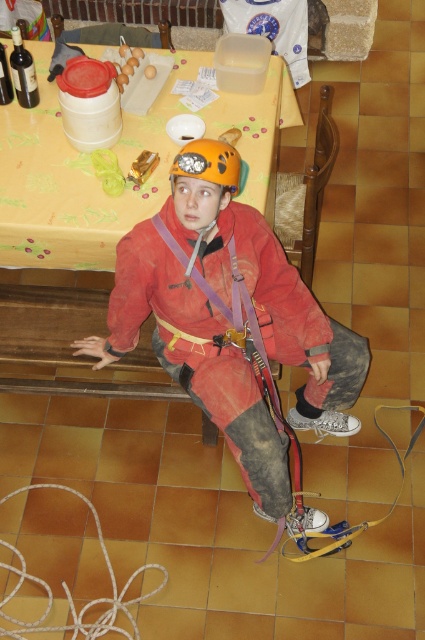
You are organizing a safety equipment display and need to place the red matte safety vest at center and orange matte helmet at center side by side on a shelf. Given that the shelf has a width of 40 cm, and the safety vest is wider than the helmet, can both items fit on the shelf without overlapping?

The red matte safety vest at center is wider than the orange matte helmet at center. However, since the exact widths are not provided, it is uncertain if both can fit on a 40 cm shelf. More information about their individual dimensions is needed to determine this.

You are organizing a safety equipment display in a small booth. The booth has limited space, and you need to arrange the red matte safety vest at center and orange matte helmet at center so that both are visible but not overcrowded. Considering their sizes, which item should you place closer to the edge of the booth to save space?

The orange matte helmet at center should be placed closer to the edge of the booth since it has a smaller size compared to the red matte safety vest at center, allowing both items to be displayed without overcrowding.

You are organizing a climbing gear setup. You need to place the matte orange helmet at center and the white rope at lower left in a storage box. According to the image, which object should be placed to the right side of the other?

The matte orange helmet at center should be placed to the right of the white rope at lower left as per the image.